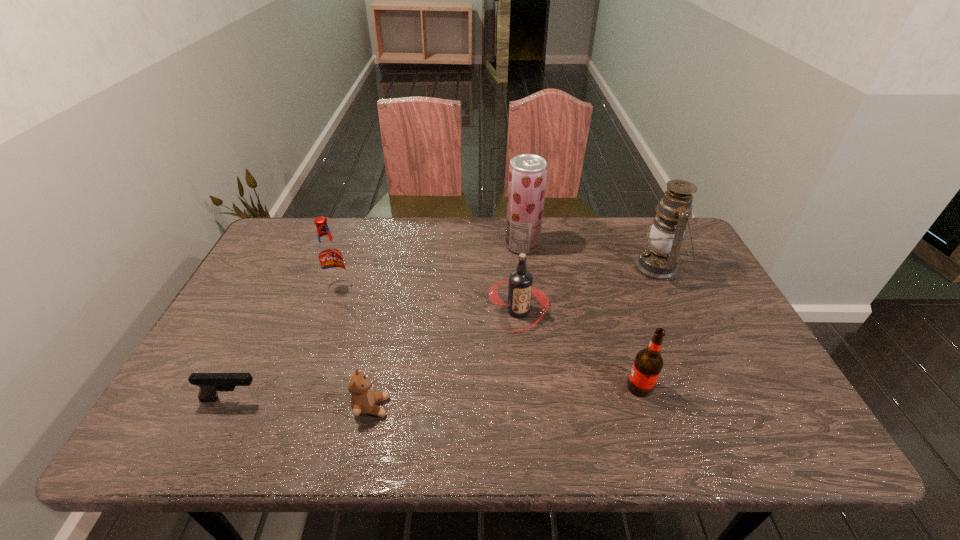
Locate an element on the screen. The width and height of the screenshot is (960, 540). fruit juice is located at coordinates (527, 178).

Where is `the rightmost object`? the rightmost object is located at coordinates (659, 261).

Where is `the tallest root beer`? The image size is (960, 540). the tallest root beer is located at coordinates (330, 257).

Image resolution: width=960 pixels, height=540 pixels. Find the location of `the fifth shortest object`. the fifth shortest object is located at coordinates (330, 257).

Where is `the second root beer from right to left`? Image resolution: width=960 pixels, height=540 pixels. the second root beer from right to left is located at coordinates (520, 287).

This screenshot has height=540, width=960. Identify the location of the sixth object from left to right. (648, 363).

Identify the location of the rightmost root beer. The height and width of the screenshot is (540, 960). (648, 363).

Find the location of a particular element. This screenshot has width=960, height=540. the third object from left to right is located at coordinates (363, 399).

In order to click on the sixth tallest object in this screenshot , I will do `click(363, 399)`.

Locate an element on the screen. the leftmost object is located at coordinates (209, 383).